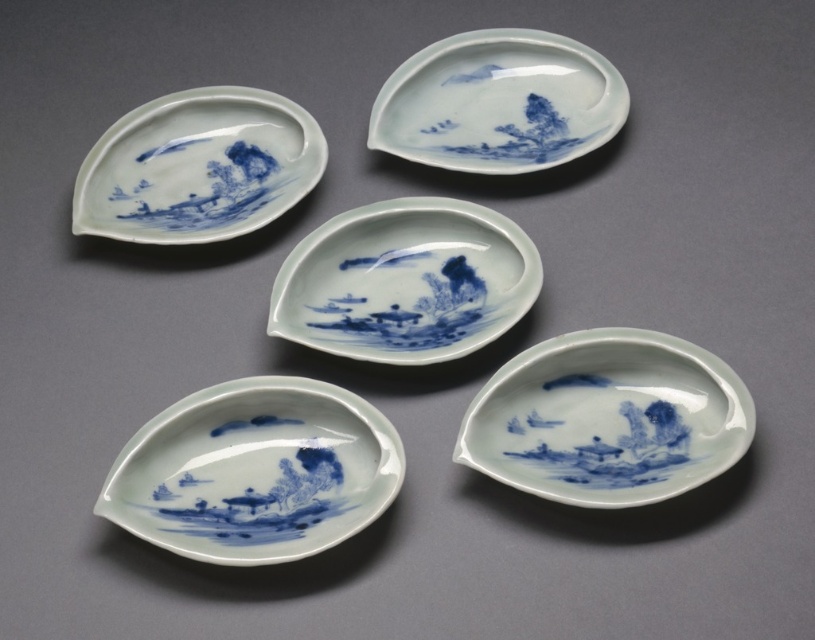
Is blue porcelain plate at bottom right below blue porcelain plate at upper center?

Yes.

Does blue porcelain plate at bottom right have a smaller size compared to blue porcelain plate at upper center?

Indeed, blue porcelain plate at bottom right has a smaller size compared to blue porcelain plate at upper center.

I want to click on blue porcelain plate at bottom right, so click(x=606, y=419).

Consider the image. Who is lower down, blue porcelain saucer at lower left or blue porcelain plate at center?

blue porcelain saucer at lower left

Between blue porcelain saucer at lower left and blue porcelain plate at center, which one is positioned higher?

blue porcelain plate at center

The image size is (815, 640). What do you see at coordinates (254, 472) in the screenshot?
I see `blue porcelain saucer at lower left` at bounding box center [254, 472].

I want to click on blue porcelain saucer at lower left, so click(x=254, y=472).

Does blue porcelain saucer at lower left appear on the right side of blue porcelain plate at upper center?

No, blue porcelain saucer at lower left is not to the right of blue porcelain plate at upper center.

Is blue porcelain saucer at lower left thinner than blue porcelain plate at upper center?

Correct, blue porcelain saucer at lower left's width is less than blue porcelain plate at upper center's.

Identify the location of blue porcelain saucer at lower left. (254, 472).